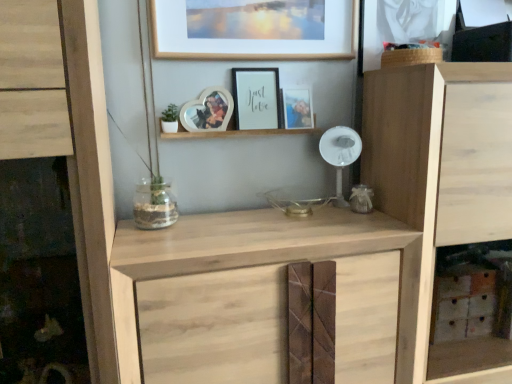
Identify the location of clear glass jar at center. (154, 204).

In the scene shown: Measure the distance between point (153, 212) and camera.

They are 4.48 feet apart.

Describe the element at coordinates (208, 111) in the screenshot. The image size is (512, 384). I see `heart-shaped photo frame at center, arranged as the first picture frame when viewed from the left` at that location.

Where is `natural wood cupboard at left, the 1th cupboard positioned from the left`? natural wood cupboard at left, the 1th cupboard positioned from the left is located at coordinates (66, 139).

The image size is (512, 384). What do you see at coordinates (66, 139) in the screenshot?
I see `natural wood cupboard at left, the 2th cupboard positioned from the right` at bounding box center [66, 139].

Locate an element on the screen. The height and width of the screenshot is (384, 512). natural wood cupboard at right, the first cupboard viewed from the right is located at coordinates (442, 190).

You are a GUI agent. You are given a task and a screenshot of the screen. Output one action in this format:
    pyautogui.click(x=<x>, y=<y>)
    Task: Click on the wooden picture frame at upper center, which is the 3th picture frame in left-to-right order
    The width and height of the screenshot is (512, 384).
    Given the screenshot: What is the action you would take?
    pyautogui.click(x=255, y=29)

The width and height of the screenshot is (512, 384). Identify the location of matte wooden picture frame at center, placed as the fourth picture frame when sorted from left to right. (297, 108).

Identify the location of clear glass jar at center. Image resolution: width=512 pixels, height=384 pixels. (154, 204).

Is matte black frame at center, which appears as the third picture frame when viewed from the right, taller or shorter than natural wood cupboard at right, the second cupboard positioned from the left?

In the image, matte black frame at center, which appears as the third picture frame when viewed from the right, appears to be shorter than natural wood cupboard at right, the second cupboard positioned from the left.

From a real-world perspective, who is located higher, matte black frame at center, which appears as the third picture frame when viewed from the right, or natural wood cupboard at right, the first cupboard viewed from the right?

From a 3D spatial view, matte black frame at center, which appears as the third picture frame when viewed from the right, is above.

Is matte black frame at center, which is the 2th picture frame from left to right, not inside natural wood cupboard at right, the first cupboard viewed from the right?

Indeed, matte black frame at center, which is the 2th picture frame from left to right, is completely outside natural wood cupboard at right, the first cupboard viewed from the right.

Which is behind, matte black frame at center, which is the 2th picture frame from left to right, or natural wood cupboard at right, the second cupboard positioned from the left?

matte black frame at center, which is the 2th picture frame from left to right, is more distant.

Considering the relative sizes of natural wood cupboard at right, the second cupboard positioned from the left, and natural wood cabinet at center in the image provided, is natural wood cupboard at right, the second cupboard positioned from the left, smaller than natural wood cabinet at center?

Actually, natural wood cupboard at right, the second cupboard positioned from the left, might be larger than natural wood cabinet at center.

Are natural wood cupboard at right, the second cupboard positioned from the left, and natural wood cabinet at center beside each other?

No, natural wood cupboard at right, the second cupboard positioned from the left, is not touching natural wood cabinet at center.

From a real-world perspective, is natural wood cupboard at right, the first cupboard viewed from the right, above or below natural wood cabinet at center?

In terms of real-world spatial position, natural wood cupboard at right, the first cupboard viewed from the right, is above natural wood cabinet at center.

Could you tell me if natural wood cupboard at right, the first cupboard viewed from the right, is turned towards natural wood cabinet at center?

No, natural wood cupboard at right, the first cupboard viewed from the right, is not facing towards natural wood cabinet at center.

Which object is positioned more to the right, clear glass jar at center or white plastic fan at center?

From the viewer's perspective, white plastic fan at center appears more on the right side.

Who is taller, clear glass jar at center or white plastic fan at center?

Standing taller between the two is white plastic fan at center.

Is clear glass jar at center oriented away from white plastic fan at center?

No, clear glass jar at center is not facing away from white plastic fan at center.

Considering the relative sizes of clear glass jar at center and white plastic fan at center in the image provided, is clear glass jar at center smaller than white plastic fan at center?

No.

Is natural wood cupboard at right, the second cupboard positioned from the left, not close to white plastic fan at center?

They are positioned close to each other.

Which of these two, natural wood cupboard at right, the second cupboard positioned from the left, or white plastic fan at center, stands shorter?

Standing shorter between the two is white plastic fan at center.

Which object is wider, natural wood cupboard at right, the second cupboard positioned from the left, or white plastic fan at center?

With larger width is natural wood cupboard at right, the second cupboard positioned from the left.

Is natural wood cupboard at right, the second cupboard positioned from the left, aimed at white plastic fan at center?

No, natural wood cupboard at right, the second cupboard positioned from the left, is not oriented towards white plastic fan at center.

Identify the location of cupboard that is the 1st object directly below the clear glass jar at center (from a real-world perspective). (66, 139).

Would you say clear glass jar at center is to the left or to the right of natural wood cupboard at left, the 2th cupboard positioned from the right, in the picture?

clear glass jar at center is positioned on natural wood cupboard at left, the 2th cupboard positioned from the right,'s right side.

Relative to natural wood cupboard at left, the 2th cupboard positioned from the right, is clear glass jar at center in front or behind?

clear glass jar at center is positioned farther from the viewer than natural wood cupboard at left, the 2th cupboard positioned from the right.

Considering the relative sizes of matte wooden picture frame at center, acting as the first picture frame starting from the right, and white plastic fan at center in the image provided, is matte wooden picture frame at center, acting as the first picture frame starting from the right, wider than white plastic fan at center?

Incorrect, the width of matte wooden picture frame at center, acting as the first picture frame starting from the right, does not surpass that of white plastic fan at center.

Would you say matte wooden picture frame at center, placed as the fourth picture frame when sorted from left to right, is to the left or to the right of white plastic fan at center in the picture?

matte wooden picture frame at center, placed as the fourth picture frame when sorted from left to right, is positioned on white plastic fan at center's left side.

Would you say white plastic fan at center is part of matte wooden picture frame at center, acting as the first picture frame starting from the right,'s contents?

No, white plastic fan at center is not surrounded by matte wooden picture frame at center, acting as the first picture frame starting from the right.

Can you confirm if natural wood cupboard at left, the 2th cupboard positioned from the right, is taller than heart-shaped photo frame at center, marked as the fourth picture frame in a right-to-left arrangement?

Yes, natural wood cupboard at left, the 2th cupboard positioned from the right, is taller than heart-shaped photo frame at center, marked as the fourth picture frame in a right-to-left arrangement.

Who is more distant, natural wood cupboard at left, the 2th cupboard positioned from the right, or heart-shaped photo frame at center, arranged as the first picture frame when viewed from the left?

heart-shaped photo frame at center, arranged as the first picture frame when viewed from the left.

Looking at their sizes, would you say natural wood cupboard at left, the 1th cupboard positioned from the left, is wider or thinner than heart-shaped photo frame at center, arranged as the first picture frame when viewed from the left?

natural wood cupboard at left, the 1th cupboard positioned from the left, is wider than heart-shaped photo frame at center, arranged as the first picture frame when viewed from the left.

Does natural wood cupboard at left, the 1th cupboard positioned from the left, have a smaller size compared to heart-shaped photo frame at center, marked as the fourth picture frame in a right-to-left arrangement?

No, natural wood cupboard at left, the 1th cupboard positioned from the left, is not smaller than heart-shaped photo frame at center, marked as the fourth picture frame in a right-to-left arrangement.

This screenshot has height=384, width=512. I want to click on the 2nd cupboard positioned below the matte black frame at center, which appears as the third picture frame when viewed from the right (from the image's perspective), so click(x=442, y=190).

You are a GUI agent. You are given a task and a screenshot of the screen. Output one action in this format:
    pyautogui.click(x=<x>, y=<y>)
    Task: Click on the cupboard behind the natural wood cabinet at center
    
    Given the screenshot: What is the action you would take?
    pyautogui.click(x=442, y=190)

Based on their spatial positions, is matte black frame at center, which is the 2th picture frame from left to right, or heart-shaped photo frame at center, arranged as the first picture frame when viewed from the left, further from natural wood cupboard at left, the 1th cupboard positioned from the left?

Among the two, matte black frame at center, which is the 2th picture frame from left to right, is located further to natural wood cupboard at left, the 1th cupboard positioned from the left.

Estimate the real-world distances between objects in this image. Which object is closer to natural wood cabinet at center, matte wooden picture frame at center, acting as the first picture frame starting from the right, or heart-shaped photo frame at center, marked as the fourth picture frame in a right-to-left arrangement?

Based on the image, heart-shaped photo frame at center, marked as the fourth picture frame in a right-to-left arrangement, appears to be nearer to natural wood cabinet at center.

Consider the image. Looking at the image, which one is located further to white plastic fan at center, natural wood cabinet at center or clear glass jar at center?

clear glass jar at center.

From the image, which object appears to be nearer to heart-shaped photo frame at center, marked as the fourth picture frame in a right-to-left arrangement, matte black frame at center, which appears as the third picture frame when viewed from the right, or matte wooden picture frame at center, acting as the first picture frame starting from the right?

matte black frame at center, which appears as the third picture frame when viewed from the right, is positioned closer to the anchor heart-shaped photo frame at center, marked as the fourth picture frame in a right-to-left arrangement.

Which object lies nearer to the anchor point natural wood cabinet at center, matte black frame at center, which appears as the third picture frame when viewed from the right, or natural wood cupboard at left, the 2th cupboard positioned from the right?

Based on the image, natural wood cupboard at left, the 2th cupboard positioned from the right, appears to be nearer to natural wood cabinet at center.

Looking at the image, which one is located closer to heart-shaped photo frame at center, arranged as the first picture frame when viewed from the left, natural wood cupboard at left, the 2th cupboard positioned from the right, or natural wood cabinet at center?

Based on the image, natural wood cupboard at left, the 2th cupboard positioned from the right, appears to be nearer to heart-shaped photo frame at center, arranged as the first picture frame when viewed from the left.

Looking at the image, which one is located further to heart-shaped photo frame at center, marked as the fourth picture frame in a right-to-left arrangement, matte wooden picture frame at center, acting as the first picture frame starting from the right, or natural wood cupboard at left, the 2th cupboard positioned from the right?

natural wood cupboard at left, the 2th cupboard positioned from the right.

Which object lies further to the anchor point natural wood cupboard at left, the 2th cupboard positioned from the right, wooden picture frame at upper center, which is the 3th picture frame in left-to-right order, or natural wood cupboard at right, the first cupboard viewed from the right?

natural wood cupboard at right, the first cupboard viewed from the right, is positioned further to the anchor natural wood cupboard at left, the 2th cupboard positioned from the right.

Identify the location of cabinetry situated between natural wood cupboard at left, the 1th cupboard positioned from the left, and matte wooden picture frame at center, placed as the fourth picture frame when sorted from left to right, from left to right. (261, 296).

The height and width of the screenshot is (384, 512). What are the coordinates of `glass vase between heart-shaped photo frame at center, marked as the fourth picture frame in a right-to-left arrangement, and natural wood cabinet at center vertically` in the screenshot? It's located at (154, 204).

Find the location of a particular element. The height and width of the screenshot is (384, 512). fan situated between natural wood cupboard at left, the 2th cupboard positioned from the right, and natural wood cupboard at right, the second cupboard positioned from the left, from left to right is located at coordinates (340, 154).

The height and width of the screenshot is (384, 512). I want to click on fan situated between wooden picture frame at upper center, which is the 3th picture frame in left-to-right order, and natural wood cupboard at right, the first cupboard viewed from the right, from left to right, so click(x=340, y=154).